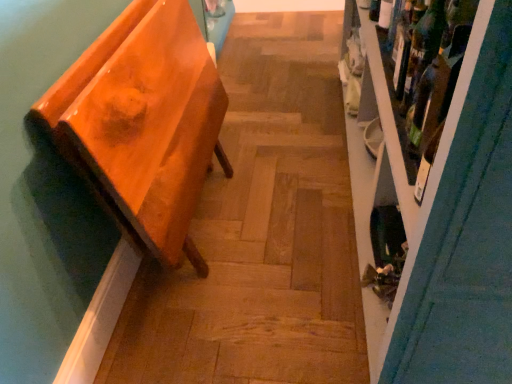
The image size is (512, 384). Describe the element at coordinates (432, 186) in the screenshot. I see `wooden shelf at right` at that location.

The image size is (512, 384). In order to click on wooden shelf at right in this screenshot , I will do `click(432, 186)`.

Measure the distance between green glass wine bottle at upper right and camera.

green glass wine bottle at upper right and camera are 31.14 inches apart.

Locate an element on the screen. The width and height of the screenshot is (512, 384). wooden shelf at right is located at coordinates (432, 186).

From a real-world perspective, is wooden shelf at right positioned over green glass wine bottle at upper right based on gravity?

No, from a real-world perspective, wooden shelf at right is not over green glass wine bottle at upper right

Is wooden shelf at right aimed at green glass wine bottle at upper right?

Yes, wooden shelf at right is turned towards green glass wine bottle at upper right.

From a real-world perspective, is translucent glass bottle at upper right under glossy orange bench at left?

Incorrect, from a real-world perspective, translucent glass bottle at upper right is higher than glossy orange bench at left.

Is translucent glass bottle at upper right to the left or to the right of glossy orange bench at left in the image?

From the image, it's evident that translucent glass bottle at upper right is to the right of glossy orange bench at left.

Looking at this image, is translucent glass bottle at upper right surrounding glossy orange bench at left?

No, translucent glass bottle at upper right does not contain glossy orange bench at left.

Is translucent glass bottle at upper right looking in the opposite direction of glossy orange bench at left?

No, translucent glass bottle at upper right is not facing the opposite direction of glossy orange bench at left.

Is translucent glass bottle at upper right oriented away from wooden shelf at right?

Correct, translucent glass bottle at upper right is looking away from wooden shelf at right.

From the picture: Which object is closer to the camera taking this photo, translucent glass bottle at upper right or wooden shelf at right?

wooden shelf at right.

From the image's perspective, which one is positioned lower, translucent glass bottle at upper right or wooden shelf at right?

From the image's view, wooden shelf at right is below.

Between translucent glass bottle at upper right and wooden shelf at right, which one has less height?

With less height is translucent glass bottle at upper right.

Which is more to the right, glossy orange bench at left or green glass wine bottle at upper right?

green glass wine bottle at upper right.

In the scene shown: Considering the sizes of objects glossy orange bench at left and green glass wine bottle at upper right in the image provided, who is smaller, glossy orange bench at left or green glass wine bottle at upper right?

With smaller size is green glass wine bottle at upper right.

Is the depth of glossy orange bench at left greater than that of green glass wine bottle at upper right?

No, it is in front of green glass wine bottle at upper right.

From the image's perspective, does glossy orange bench at left appear lower than green glass wine bottle at upper right?

Indeed, from the image's perspective, glossy orange bench at left is shown beneath green glass wine bottle at upper right.

From the image's perspective, between wooden shelf at right and glossy orange bench at left, which one is located above?

wooden shelf at right is shown above in the image.

Is wooden shelf at right inside the boundaries of glossy orange bench at left, or outside?

wooden shelf at right is outside glossy orange bench at left.

Where is `furniture on the left of wooden shelf at right`? Image resolution: width=512 pixels, height=384 pixels. furniture on the left of wooden shelf at right is located at coordinates (143, 124).

Is glossy orange bench at left not within wooden shelf at right?

Yes, glossy orange bench at left is not within wooden shelf at right.

Considering the positions of objects glossy orange bench at left and wooden shelf at right in the image provided, who is more to the left, glossy orange bench at left or wooden shelf at right?

glossy orange bench at left.

Is the position of glossy orange bench at left more distant than that of wooden shelf at right?

That is True.

Can you tell me how much green glass wine bottle at upper right and glossy orange bench at left differ in facing direction?

179 degrees.

Which point is more forward, (414, 96) or (180, 148)?

The point (414, 96) is closer to the camera.

Visually, is green glass wine bottle at upper right positioned to the left or to the right of glossy orange bench at left?

From the image, it's evident that green glass wine bottle at upper right is to the right of glossy orange bench at left.

Where is `wine bottle on the right of glossy orange bench at left`? The image size is (512, 384). wine bottle on the right of glossy orange bench at left is located at coordinates (423, 49).

Find the location of `wine bottle located behind the wooden shelf at right`. wine bottle located behind the wooden shelf at right is located at coordinates point(423,49).

Image resolution: width=512 pixels, height=384 pixels. I want to click on furniture on the left of translucent glass bottle at upper right, so click(143, 124).

When comparing their distances from green glass wine bottle at upper right, does glossy orange bench at left or translucent glass bottle at upper right seem further?

glossy orange bench at left.

From the image, which object appears to be farther from wooden shelf at right, green glass wine bottle at upper right or glossy orange bench at left?

Among the two, glossy orange bench at left is located further to wooden shelf at right.

Considering their positions, is translucent glass bottle at upper right positioned closer to wooden shelf at right than green glass wine bottle at upper right?

green glass wine bottle at upper right is positioned closer to the anchor wooden shelf at right.

Looking at the image, which one is located closer to glossy orange bench at left, wooden shelf at right or translucent glass bottle at upper right?

wooden shelf at right.

Estimate the real-world distances between objects in this image. Which object is further from glossy orange bench at left, green glass wine bottle at upper right or wooden shelf at right?

green glass wine bottle at upper right is further to glossy orange bench at left.

From the image, which object appears to be farther from translucent glass bottle at upper right, wooden shelf at right or glossy orange bench at left?

Based on the image, glossy orange bench at left appears to be further to translucent glass bottle at upper right.

Which object lies further to the anchor point wooden shelf at right, green glass wine bottle at upper right or translucent glass bottle at upper right?

translucent glass bottle at upper right is positioned further to the anchor wooden shelf at right.

In the scene shown: Looking at the image, which one is located further to glossy orange bench at left, translucent glass bottle at upper right or wooden shelf at right?

translucent glass bottle at upper right is further to glossy orange bench at left.

The width and height of the screenshot is (512, 384). Find the location of `wine bottle located between glossy orange bench at left and translucent glass bottle at upper right in the left-right direction`. wine bottle located between glossy orange bench at left and translucent glass bottle at upper right in the left-right direction is located at coordinates (423, 49).

Find the location of `wine bottle between wooden shelf at right and translucent glass bottle at upper right along the z-axis`. wine bottle between wooden shelf at right and translucent glass bottle at upper right along the z-axis is located at coordinates (423, 49).

You are a GUI agent. You are given a task and a screenshot of the screen. Output one action in this format:
    pyautogui.click(x=<x>, y=<y>)
    Task: Click on the wine bottle located between glossy orange bench at left and wooden shelf at right in the left-right direction
    This screenshot has height=384, width=512.
    Given the screenshot: What is the action you would take?
    pyautogui.click(x=423, y=49)

Find the location of a particular element. Image resolution: width=512 pixels, height=384 pixels. furniture between wooden shelf at right and translucent glass bottle at upper right in the front-back direction is located at coordinates (143, 124).